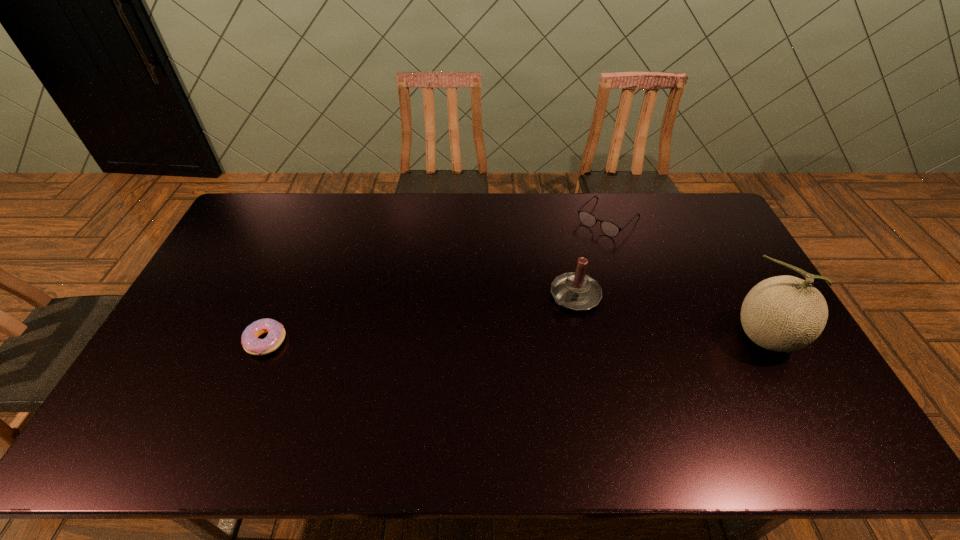
The image size is (960, 540). Find the location of `the leftmost object`. the leftmost object is located at coordinates (251, 343).

Find the location of `the shortest object`. the shortest object is located at coordinates (251, 343).

The image size is (960, 540). Identify the location of the tallest object. (784, 313).

Where is `the rightmost object`? This screenshot has width=960, height=540. the rightmost object is located at coordinates (784, 313).

You are a GUI agent. You are given a task and a screenshot of the screen. Output one action in this format:
    pyautogui.click(x=<x>, y=<y>)
    Task: Click on the third tallest object
    
    Given the screenshot: What is the action you would take?
    pyautogui.click(x=610, y=229)

Identify the location of spectacles. The width and height of the screenshot is (960, 540). (610, 229).

Image resolution: width=960 pixels, height=540 pixels. Find the location of `candle`. candle is located at coordinates (576, 291).

The image size is (960, 540). Find the location of `vacant space located 0.400m on the right of the leftmost object`. vacant space located 0.400m on the right of the leftmost object is located at coordinates (427, 341).

Where is `free space located on the left of the cantaloup`? The image size is (960, 540). free space located on the left of the cantaloup is located at coordinates (612, 337).

Locate an element on the screen. Image resolution: width=960 pixels, height=540 pixels. vacant space located 0.330m on the front-facing side of the farthest object is located at coordinates (540, 290).